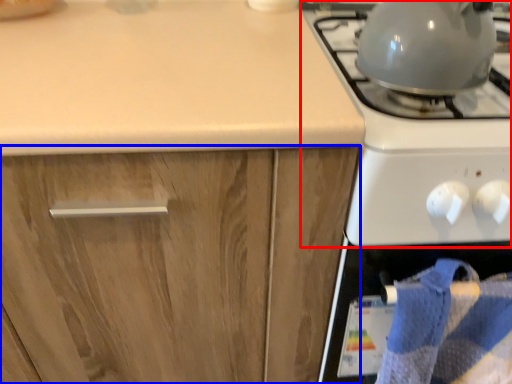
Question: Which object is closer to the camera taking this photo, gas stove (highlighted by a red box) or cabinetry (highlighted by a blue box)?

Choices:
 (A) gas stove
 (B) cabinetry

Answer: (A)